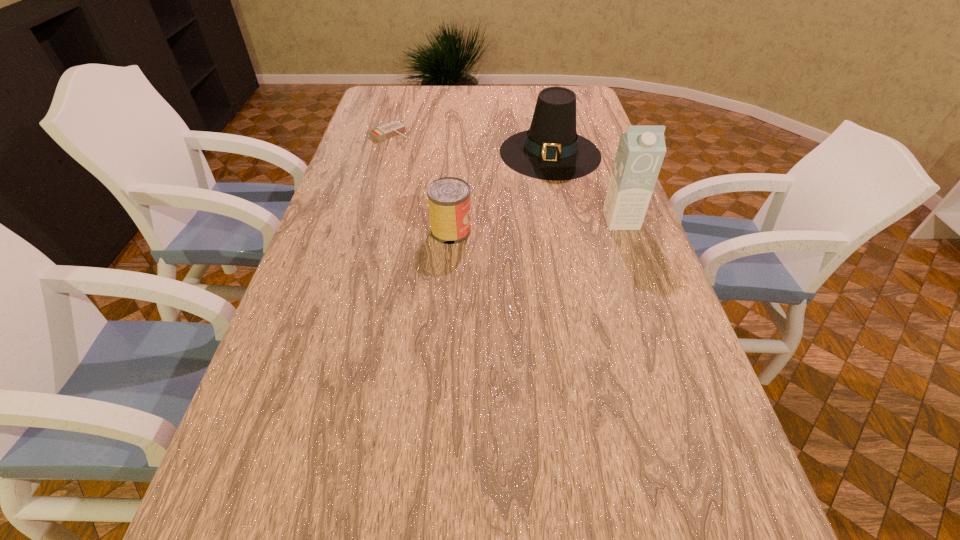
Where is `can`? The width and height of the screenshot is (960, 540). can is located at coordinates (448, 198).

Locate an element on the screen. The height and width of the screenshot is (540, 960). the second object from left to right is located at coordinates point(448,198).

This screenshot has width=960, height=540. I want to click on carton, so click(x=640, y=153).

Find the location of a particular element. The height and width of the screenshot is (540, 960). matchbox is located at coordinates (384, 132).

Locate an element on the screen. Image resolution: width=960 pixels, height=540 pixels. the leftmost object is located at coordinates (384, 132).

Where is `the third shortest object`? The image size is (960, 540). the third shortest object is located at coordinates (551, 149).

What are the coordinates of `vacant space located 0.090m on the left of the third object from right to left` in the screenshot? It's located at (399, 231).

Locate an element on the screen. This screenshot has width=960, height=540. vacant space located on the front label of the carton is located at coordinates (629, 242).

This screenshot has height=540, width=960. I want to click on vacant region located 0.340m on the striking surface of the matchbox, so click(458, 181).

Identify the location of free region located 0.150m on the striking surface of the matchbox. This screenshot has width=960, height=540. (424, 157).